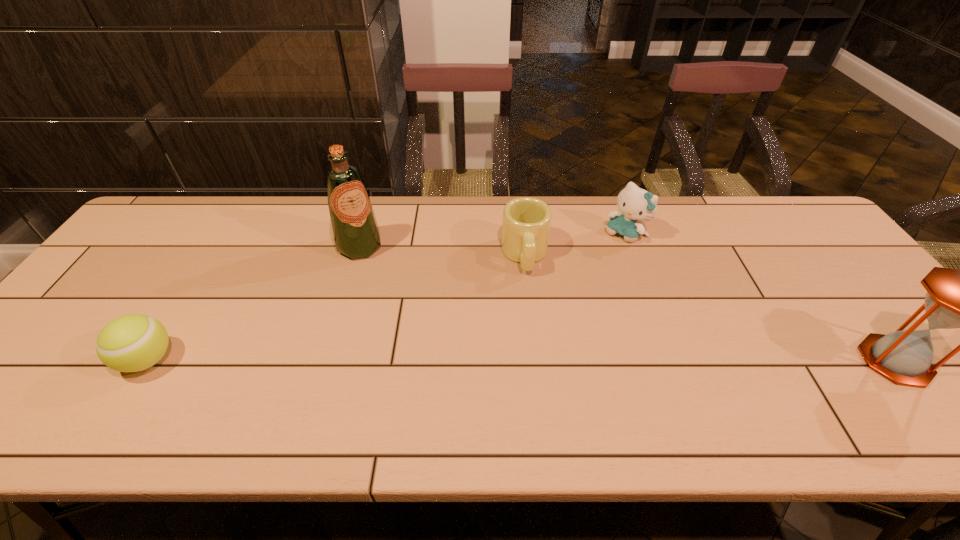
Where is `kitten that is positioned at the far edge`? The width and height of the screenshot is (960, 540). kitten that is positioned at the far edge is located at coordinates (635, 204).

This screenshot has width=960, height=540. What are the coordinates of `mug that is at the far edge` in the screenshot? It's located at (526, 225).

Where is `tennis ball present at the near edge`? tennis ball present at the near edge is located at coordinates (131, 343).

I want to click on hourglass situated at the near edge, so click(x=956, y=298).

The width and height of the screenshot is (960, 540). What are the coordinates of `object that is at the right edge` in the screenshot? It's located at (956, 298).

You are a GUI agent. You are given a task and a screenshot of the screen. Output one action in this format:
    pyautogui.click(x=<x>, y=<y>)
    Task: Click on the object present at the near right corner
    This screenshot has height=540, width=960.
    Given the screenshot: What is the action you would take?
    pyautogui.click(x=956, y=298)

In order to click on vacant space at the far edge in this screenshot , I will do `click(498, 215)`.

Where is `vacant region at the near edge of the desktop`? This screenshot has height=540, width=960. vacant region at the near edge of the desktop is located at coordinates [x=217, y=369].

Locate an element on the screen. This screenshot has width=960, height=540. vacant point at the far left corner is located at coordinates (x=191, y=223).

In the image, there is a desktop. At what (x,y) coordinates should I click in order to perform the action: click on free space at the near left corner. Please return your answer as a coordinate pair (x, y). Image resolution: width=960 pixels, height=540 pixels. Looking at the image, I should click on (85, 368).